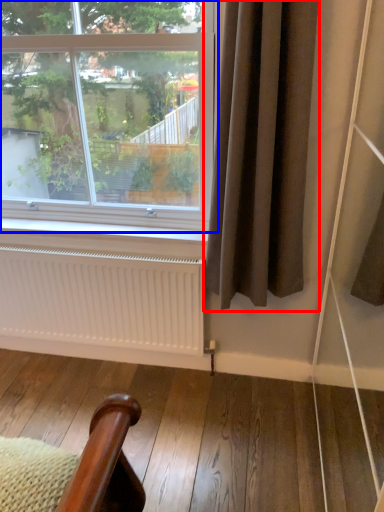
Question: Which point is closer to the camera, curtain (highlighted by a red box) or window (highlighted by a blue box)?

Choices:
 (A) curtain
 (B) window

Answer: (A)